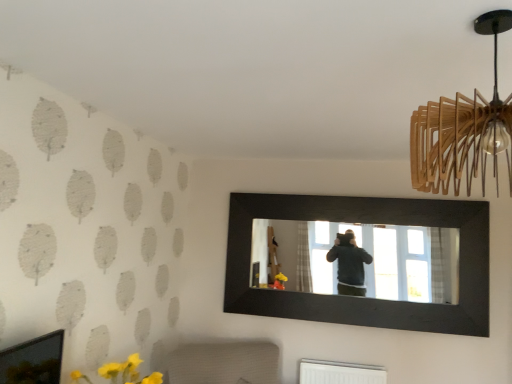
Question: From the image's perspective, is black wooden mirror at center positioned above or below white textured radiator at lower center?

Choices:
 (A) below
 (B) above

Answer: (B)

Question: In the image, is black wooden mirror at center on the left side or the right side of white textured radiator at lower center?

Choices:
 (A) left
 (B) right

Answer: (B)

Question: Which object is the farthest from the black wooden mirror at center?

Choices:
 (A) white textured radiator at lower center
 (B) wooden pendant light at upper right

Answer: (B)

Question: Estimate the real-world distances between objects in this image. Which object is farther from the wooden pendant light at upper right?

Choices:
 (A) white textured radiator at lower center
 (B) black wooden mirror at center

Answer: (A)